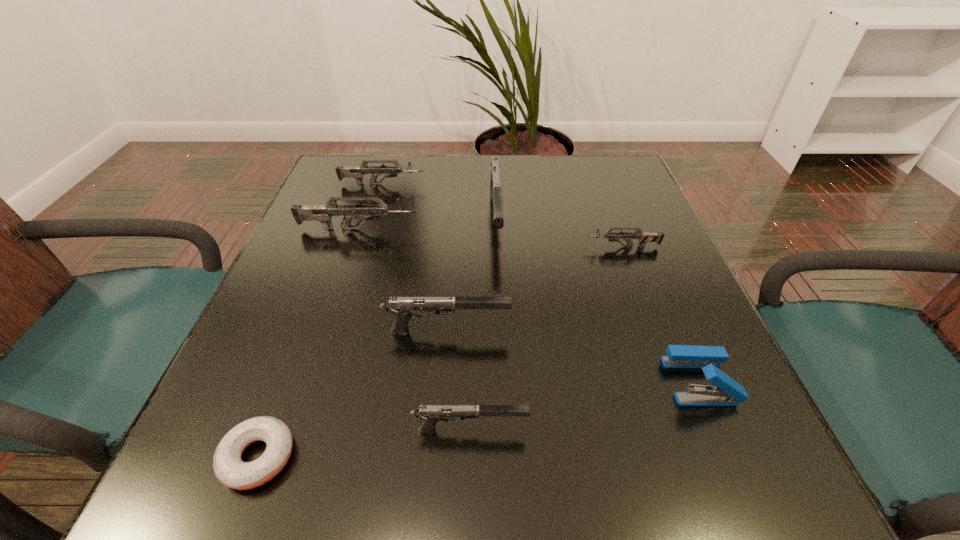
At what (x,y) coordinates should I click in order to perform the action: click on the tallest object. Please return your answer as a coordinate pair (x, y). The width and height of the screenshot is (960, 540). Looking at the image, I should click on (496, 194).

This screenshot has width=960, height=540. In order to click on the biggest gray gun in this screenshot , I will do `click(496, 194)`.

Find the location of a particular element. the second farthest grey gun is located at coordinates click(x=323, y=213).

At what (x,y) coordinates should I click in order to perform the action: click on the second nearest gray gun. Please return your answer as a coordinate pair (x, y). Image resolution: width=960 pixels, height=540 pixels. Looking at the image, I should click on (402, 307).

In order to click on the second smallest gray gun in this screenshot , I will do 402,307.

Locate an element on the screen. This screenshot has width=960, height=540. the third nearest object is located at coordinates (727, 392).

Where is `stapler`? The width and height of the screenshot is (960, 540). stapler is located at coordinates (727, 392).

The image size is (960, 540). I want to click on the farthest gun, so click(x=357, y=172).

Locate an element on the screen. Image resolution: width=960 pixels, height=540 pixels. the second smallest grey gun is located at coordinates (357, 172).

Identify the location of the nearest gun. (429, 414).